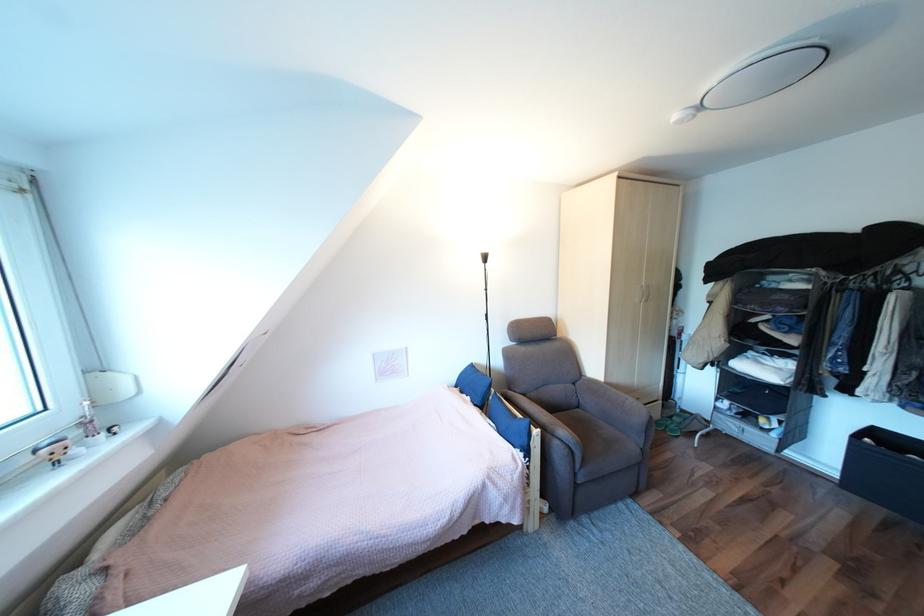
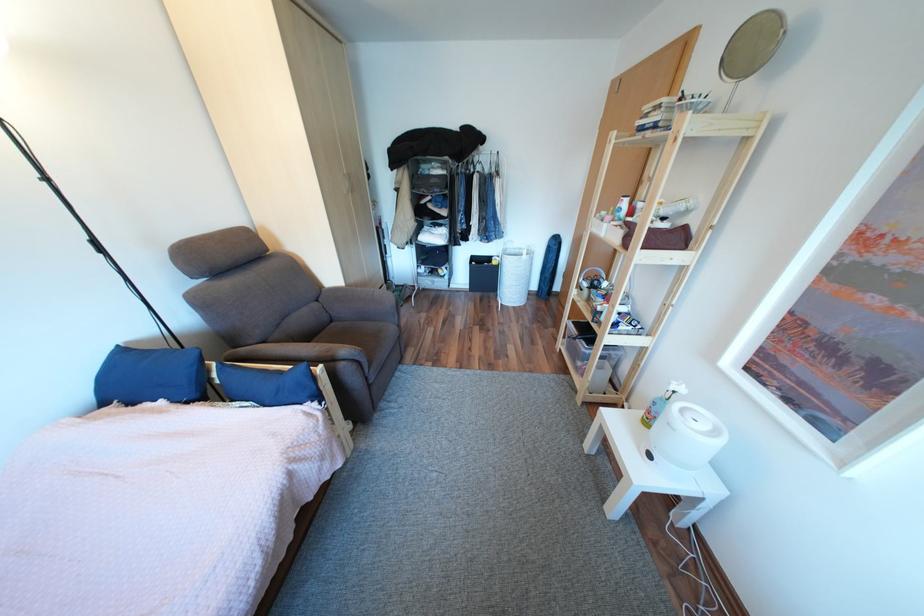
Find the pixel in the second image that matches pixel 585 384 in the first image.

(329, 301)